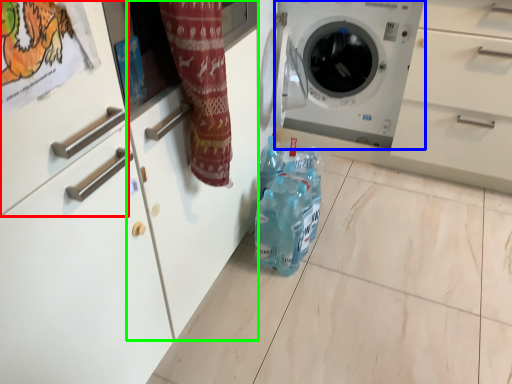
Question: Considering the real-world distances, which object is farthest from drawer (highlighted by a red box)? washing machine (highlighted by a blue box) or cabinetry (highlighted by a green box)?

Choices:
 (A) washing machine
 (B) cabinetry

Answer: (A)